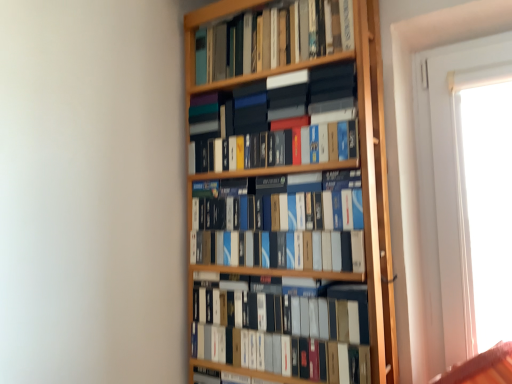
Question: In terms of width, does hardcover books at upper center, marked as the 4th book in a bottom-to-top arrangement, look wider or thinner when compared to matte black box at center, positioned as the first book in bottom-to-top order?

Choices:
 (A) thin
 (B) wide

Answer: (B)

Question: From their relative heights in the image, would you say hardcover books at upper center, which is the 1th book in top-to-bottom order, is taller or shorter than matte black box at center, the 4th book positioned from the top?

Choices:
 (A) tall
 (B) short

Answer: (B)

Question: Estimate the real-world distances between objects in this image. Which object is closer to the matte black books at center, the 2th book when ordered from top to bottom?

Choices:
 (A) matte black box at center, positioned as the first book in bottom-to-top order
 (B) blue matte book at center, which is the 3th book in top-to-bottom order
 (C) hardcover books at upper center, marked as the 4th book in a bottom-to-top arrangement

Answer: (C)

Question: Which of these objects is positioned closest to the matte black books at center, the 2th book when ordered from top to bottom?

Choices:
 (A) hardcover books at upper center, which is the 1th book in top-to-bottom order
 (B) blue matte book at center, the second book from the bottom
 (C) matte black box at center, the 4th book positioned from the top

Answer: (A)